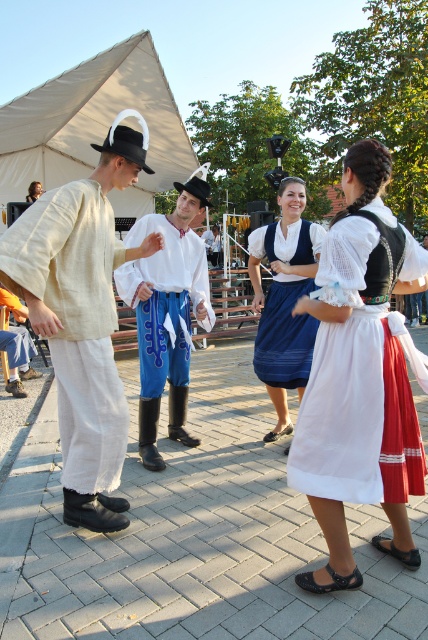
Question: Does white canvas tent at upper left appear over smooth brown hair at upper left?

Choices:
 (A) no
 (B) yes

Answer: (B)

Question: Which object is positioned closest to the white canvas tent at upper left?

Choices:
 (A) smooth brown hair at upper left
 (B) matte white shirt at center

Answer: (A)

Question: Is white canvas tent at upper left wider than blue cotton skirt at center?

Choices:
 (A) yes
 (B) no

Answer: (A)

Question: Does white cotton dress at center have a greater width compared to white linen shirt at center?

Choices:
 (A) yes
 (B) no

Answer: (B)

Question: Considering the real-world distances, which object is farthest from the white linen shirt at center?

Choices:
 (A) white canvas tent at upper left
 (B) white cotton dress at center
 (C) matte white shirt at center
 (D) blue cotton skirt at center

Answer: (A)

Question: Which point appears closest to the camera in this image?

Choices:
 (A) (272, 243)
 (B) (353, 273)
 (C) (109, 397)

Answer: (B)